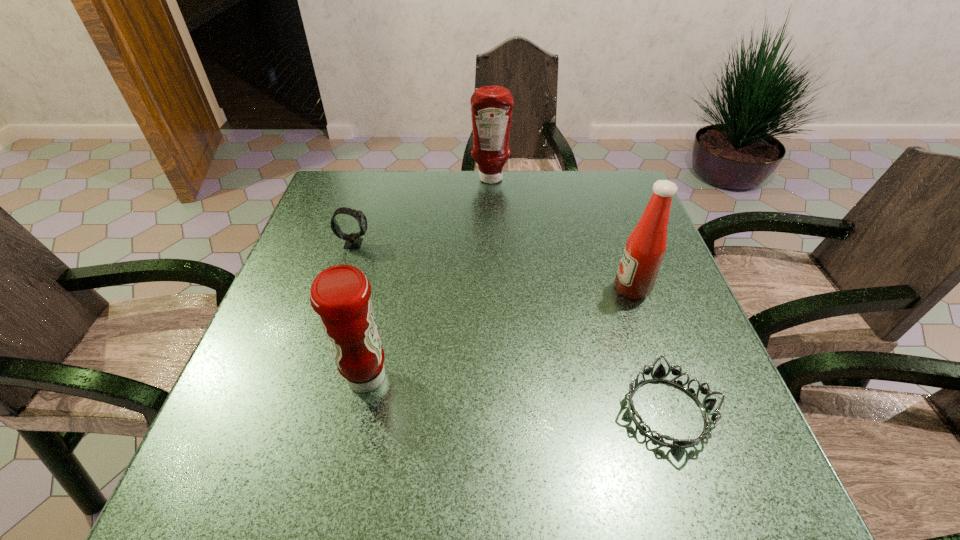
Find the location of a particular element. Image resolution: width=960 pixels, height=540 pixels. condiment that is the second closest to the farthest condiment is located at coordinates (340, 295).

Locate an element on the screen. vacant region that satisfies the following two spatial constraints: 1. on the face of the fourth tallest object; 2. on the back side of the leftmost condiment is located at coordinates (311, 377).